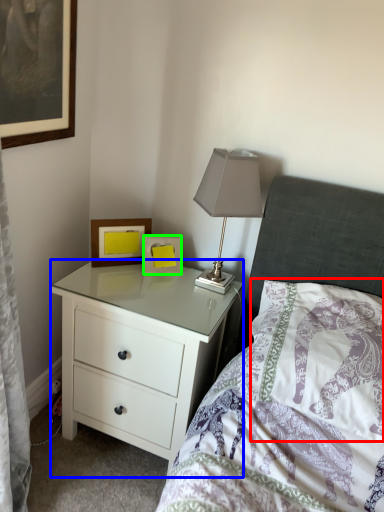
Question: Estimate the real-world distances between objects in this image. Which object is farther from pillow (highlighted by a red box), chest of drawers (highlighted by a blue box) or picture frame (highlighted by a green box)?

Choices:
 (A) chest of drawers
 (B) picture frame

Answer: (B)